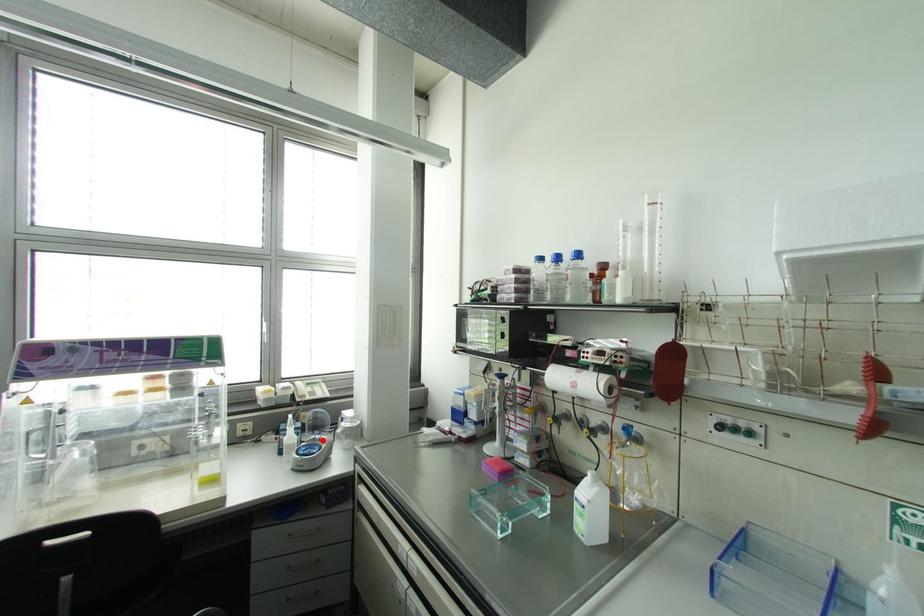
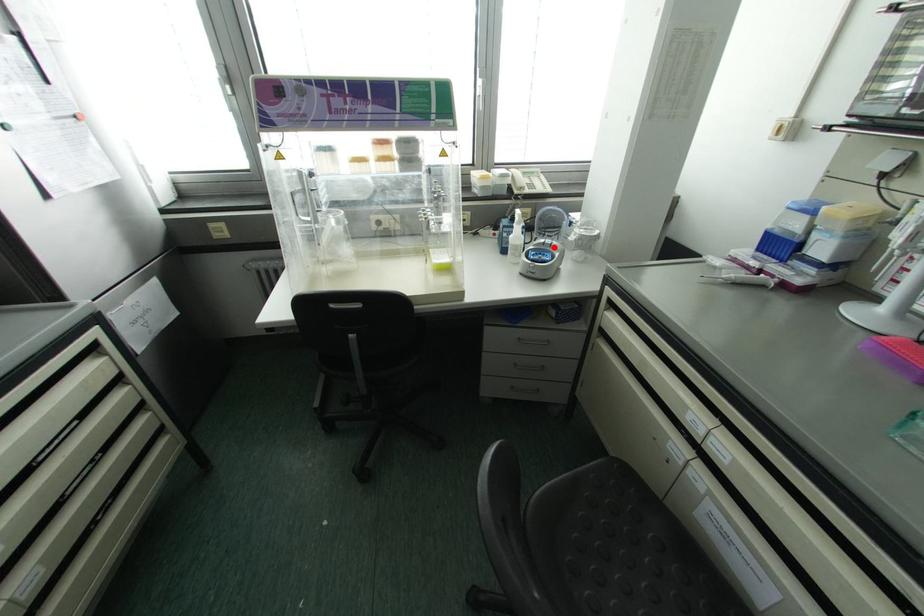
I am providing you with two images of the same scene from different viewpoints. A red point is marked on the first image and another point is marked on the second image. Are the points marked in image1 and image2 representing the same 3D position?

Yes